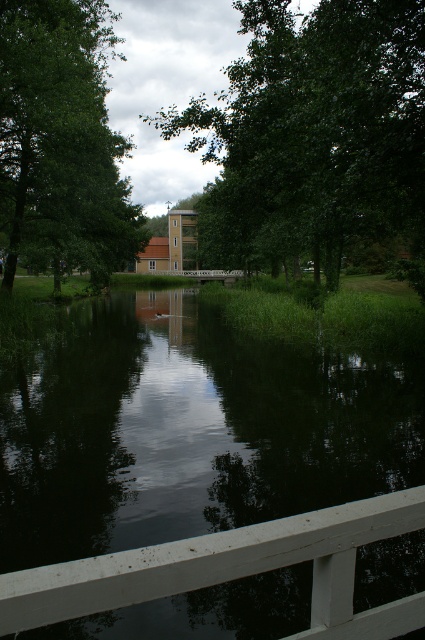
You are standing on the white painted wood rail at lower center and want to look towards the green leafy tree at upper left. In which direction should you turn your head?

You should turn your head to the left to face the green leafy tree at upper left since it is located to the left of the white painted wood rail at lower center.

You are an architect designing a new garden path that needs to pass between the green leafy tree at center and the green leafy tree at upper left. Considering their heights, which tree might require more careful planning to avoid blocking sunlight for the path area?

The green leafy tree at center is taller than the green leafy tree at upper left, so it might require more careful planning to avoid blocking sunlight for the path area.

You are standing at the center of the white bridge and want to locate the dark reflective water at center. According to the coordinates provided, in which direction should you look to find it?

The dark reflective water at center is located at coordinates point (187, 433). Since you are at the center of the white bridge, you should look towards the direction indicated by those coordinates to find it.